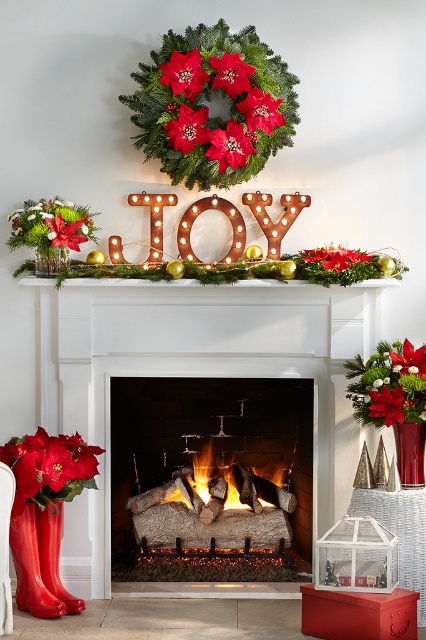
Question: Considering the relative positions of green matte wreath at upper center and red velvet poinsettia at lower left in the image provided, where is green matte wreath at upper center located with respect to red velvet poinsettia at lower left?

Choices:
 (A) left
 (B) right

Answer: (B)

Question: Which of these objects is positioned farthest from the glossy rubber boots at lower left?

Choices:
 (A) green matte wreath at upper center
 (B) charcoal wood fire at center

Answer: (A)

Question: Which point is farther to the camera?

Choices:
 (A) (238, 476)
 (B) (282, 502)
 (C) (49, 477)

Answer: (A)

Question: Which of these objects is positioned farthest from the green matte wreath at upper center?

Choices:
 (A) red velvet poinsettia at lower left
 (B) glossy rubber boots at lower left
 (C) wooden logs at center
 (D) charcoal wood fire at center

Answer: (D)

Question: Where is wooden logs at center located in relation to glossy rubber boots at lower left in the image?

Choices:
 (A) right
 (B) left

Answer: (A)

Question: Does wooden logs at center appear over green matte wreath at upper center?

Choices:
 (A) yes
 (B) no

Answer: (B)